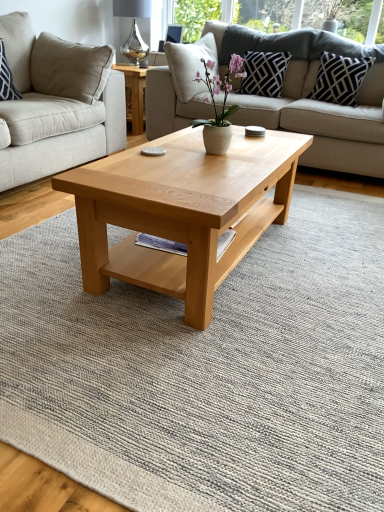
What do you see at coordinates (133, 28) in the screenshot? I see `silver metallic lamp at upper center` at bounding box center [133, 28].

Locate an element on the screen. This screenshot has width=384, height=512. silver metallic lamp at upper center is located at coordinates (133, 28).

What do you see at coordinates (324, 119) in the screenshot? I see `light beige fabric couch at center, placed as the second studio couch when sorted from left to right` at bounding box center [324, 119].

Measure the distance between point (161, 210) and camera.

Point (161, 210) and camera are 4.17 feet apart.

The width and height of the screenshot is (384, 512). I want to click on dark blue textured pillow at upper right, acting as the second pillow starting from the right, so click(x=264, y=73).

Find the location of a particular element. beige fabric studio couch at center, acting as the first studio couch starting from the left is located at coordinates (57, 104).

From the image's perspective, is dark blue textured pillow at upper right, the second pillow in the left-to-right sequence, above natural wood coffee table at center?

Yes.

From a real-world perspective, starting from the natural wood coffee table at center, which pillow is the 1st one vertically above it? Please provide its 2D coordinates.

[(264, 73)]

Which is nearer, (264, 65) or (180, 214)?

Point (264, 65) is farther from the camera than point (180, 214).

Consider the image. Is dark blue textured pillow at upper right, acting as the second pillow starting from the right, facing away from natural wood coffee table at center?

No.

Considering the relative positions of beige fabric studio couch at center, acting as the first studio couch starting from the left, and blue and white striped pillow at upper left, acting as the first pillow starting from the left, in the image provided, is beige fabric studio couch at center, acting as the first studio couch starting from the left, in front of blue and white striped pillow at upper left, acting as the first pillow starting from the left,?

Yes.

Which of these two, beige fabric studio couch at center, the 2th studio couch viewed from the right, or blue and white striped pillow at upper left, which is the 3th pillow in right-to-left order, is smaller?

blue and white striped pillow at upper left, which is the 3th pillow in right-to-left order.

From a real-world perspective, is beige fabric studio couch at center, the 2th studio couch viewed from the right, located beneath blue and white striped pillow at upper left, acting as the first pillow starting from the left?

Indeed, from a real-world perspective, beige fabric studio couch at center, the 2th studio couch viewed from the right, is positioned beneath blue and white striped pillow at upper left, acting as the first pillow starting from the left.

Which is farther from the camera, (100, 154) or (29, 72)?

The point (100, 154) is farther.

In the scene shown: From a real-world perspective, which is physically above, beige fabric studio couch at center, the 2th studio couch viewed from the right, or dark blue geometric-patterned pillow at upper right, placed as the first pillow when sorted from right to left?

In real-world perspective, dark blue geometric-patterned pillow at upper right, placed as the first pillow when sorted from right to left, is above.

Considering the relative sizes of beige fabric studio couch at center, acting as the first studio couch starting from the left, and dark blue geometric-patterned pillow at upper right, placed as the 3th pillow when sorted from left to right, in the image provided, is beige fabric studio couch at center, acting as the first studio couch starting from the left, smaller than dark blue geometric-patterned pillow at upper right, placed as the 3th pillow when sorted from left to right,?

No.

Is beige fabric studio couch at center, the 2th studio couch viewed from the right, taller or shorter than dark blue geometric-patterned pillow at upper right, placed as the first pillow when sorted from right to left?

In the image, beige fabric studio couch at center, the 2th studio couch viewed from the right, appears to be taller than dark blue geometric-patterned pillow at upper right, placed as the first pillow when sorted from right to left.

Is beige fabric studio couch at center, acting as the first studio couch starting from the left, wider or thinner than dark blue geometric-patterned pillow at upper right, placed as the first pillow when sorted from right to left?

In the image, beige fabric studio couch at center, acting as the first studio couch starting from the left, appears to be wider than dark blue geometric-patterned pillow at upper right, placed as the first pillow when sorted from right to left.

Is beige fabric studio couch at center, acting as the first studio couch starting from the left, next to dark blue textured pillow at upper right, the second pillow in the left-to-right sequence, and touching it?

They are not placed beside each other.

Can you tell me how much beige fabric studio couch at center, the 2th studio couch viewed from the right, and dark blue textured pillow at upper right, the second pillow in the left-to-right sequence, differ in facing direction?

The angle between the facing direction of beige fabric studio couch at center, the 2th studio couch viewed from the right, and the facing direction of dark blue textured pillow at upper right, the second pillow in the left-to-right sequence, is 89.6 degrees.

Is point (79, 156) positioned before point (254, 82)?

Yes, it is.

Choose the correct answer: Is natural wood coffee table at center inside beige fabric studio couch at center, the 2th studio couch viewed from the right, or outside it?

natural wood coffee table at center is outside beige fabric studio couch at center, the 2th studio couch viewed from the right.

Is there a large distance between natural wood coffee table at center and beige fabric studio couch at center, the 2th studio couch viewed from the right?

Yes, natural wood coffee table at center is far from beige fabric studio couch at center, the 2th studio couch viewed from the right.

From the image's perspective, does natural wood coffee table at center appear lower than beige fabric studio couch at center, acting as the first studio couch starting from the left?

Yes, from the image's perspective, natural wood coffee table at center is below beige fabric studio couch at center, acting as the first studio couch starting from the left.

Does natural wood coffee table at center have a smaller size compared to beige fabric studio couch at center, the 2th studio couch viewed from the right?

Yes, natural wood coffee table at center is smaller than beige fabric studio couch at center, the 2th studio couch viewed from the right.

In the scene shown: Considering the sizes of objects blue and white striped pillow at upper left, which is the 3th pillow in right-to-left order, and beige fabric studio couch at center, acting as the first studio couch starting from the left, in the image provided, who is taller, blue and white striped pillow at upper left, which is the 3th pillow in right-to-left order, or beige fabric studio couch at center, acting as the first studio couch starting from the left,?

With more height is beige fabric studio couch at center, acting as the first studio couch starting from the left.

Is blue and white striped pillow at upper left, which is the 3th pillow in right-to-left order, not near beige fabric studio couch at center, the 2th studio couch viewed from the right?

They are positioned close to each other.

Can beige fabric studio couch at center, acting as the first studio couch starting from the left, be found inside blue and white striped pillow at upper left, which is the 3th pillow in right-to-left order?

Definitely not — beige fabric studio couch at center, acting as the first studio couch starting from the left, is not inside blue and white striped pillow at upper left, which is the 3th pillow in right-to-left order.

How far apart are blue and white striped pillow at upper left, which is the 3th pillow in right-to-left order, and beige fabric studio couch at center, the 2th studio couch viewed from the right?

The distance of blue and white striped pillow at upper left, which is the 3th pillow in right-to-left order, from beige fabric studio couch at center, the 2th studio couch viewed from the right, is 29.91 centimeters.

Consider the image. From a real-world perspective, is white matte vase at center on light beige fabric couch at center, which is the 1th studio couch from right to left?

Yes, from a real-world perspective, white matte vase at center is over light beige fabric couch at center, which is the 1th studio couch from right to left

Which of these two, white matte vase at center or light beige fabric couch at center, placed as the second studio couch when sorted from left to right, stands shorter?

white matte vase at center.

Considering their positions, is white matte vase at center located in front of or behind light beige fabric couch at center, placed as the second studio couch when sorted from left to right?

In the image, white matte vase at center appears in front of light beige fabric couch at center, placed as the second studio couch when sorted from left to right.

Is white matte vase at center to the left of light beige fabric couch at center, placed as the second studio couch when sorted from left to right, from the viewer's perspective?

Correct, you'll find white matte vase at center to the left of light beige fabric couch at center, placed as the second studio couch when sorted from left to right.

In order to click on the 3rd pillow behind the natural wood coffee table at center, starting your count from the anchor in this screenshot , I will do `click(264, 73)`.

Starting from the blue and white striped pillow at upper left, which is the 3th pillow in right-to-left order, which studio couch is the 1st one to the right? Please provide its 2D coordinates.

[(57, 104)]

Considering their positions, is blue and white striped pillow at upper left, which is the 3th pillow in right-to-left order, positioned further to light beige fabric couch at center, which is the 1th studio couch from right to left, than silver metallic lamp at upper center?

Among the two, silver metallic lamp at upper center is located further to light beige fabric couch at center, which is the 1th studio couch from right to left.

From the image, which object appears to be farther from white matte vase at center, silver metallic lamp at upper center or light beige fabric couch at center, placed as the second studio couch when sorted from left to right?

silver metallic lamp at upper center.

From the image, which object appears to be nearer to white matte vase at center, blue and white striped pillow at upper left, acting as the first pillow starting from the left, or silver metallic lamp at upper center?

The object closer to white matte vase at center is blue and white striped pillow at upper left, acting as the first pillow starting from the left.

Which object lies further to the anchor point blue and white striped pillow at upper left, which is the 3th pillow in right-to-left order, dark blue textured pillow at upper right, the second pillow in the left-to-right sequence, or natural wood coffee table at center?

Based on the image, natural wood coffee table at center appears to be further to blue and white striped pillow at upper left, which is the 3th pillow in right-to-left order.

From the picture: Which object lies nearer to the anchor point beige fabric studio couch at center, the 2th studio couch viewed from the right, silver metallic lamp at upper center or light beige fabric couch at center, placed as the second studio couch when sorted from left to right?

Based on the image, light beige fabric couch at center, placed as the second studio couch when sorted from left to right, appears to be nearer to beige fabric studio couch at center, the 2th studio couch viewed from the right.

Estimate the real-world distances between objects in this image. Which object is further from light beige fabric couch at center, which is the 1th studio couch from right to left, natural wood coffee table at center or beige fabric studio couch at center, the 2th studio couch viewed from the right?

natural wood coffee table at center is further to light beige fabric couch at center, which is the 1th studio couch from right to left.

When comparing their distances from silver metallic lamp at upper center, does natural wood coffee table at center or dark blue textured pillow at upper right, the second pillow in the left-to-right sequence, seem closer?

dark blue textured pillow at upper right, the second pillow in the left-to-right sequence, is closer to silver metallic lamp at upper center.

From the image, which object appears to be nearer to dark blue geometric-patterned pillow at upper right, placed as the 3th pillow when sorted from left to right, light beige fabric couch at center, which is the 1th studio couch from right to left, or silver metallic lamp at upper center?

Based on the image, light beige fabric couch at center, which is the 1th studio couch from right to left, appears to be nearer to dark blue geometric-patterned pillow at upper right, placed as the 3th pillow when sorted from left to right.

I want to click on pillow between blue and white striped pillow at upper left, acting as the first pillow starting from the left, and dark blue geometric-patterned pillow at upper right, placed as the 3th pillow when sorted from left to right, so click(264, 73).

Identify the location of coffee table situated between beige fabric studio couch at center, acting as the first studio couch starting from the left, and light beige fabric couch at center, which is the 1th studio couch from right to left, from left to right. (181, 211).

In order to click on houseplant between blue and white striped pillow at upper left, acting as the first pillow starting from the left, and light beige fabric couch at center, which is the 1th studio couch from right to left, in the horizontal direction in this screenshot , I will do `click(222, 106)`.

Where is `houseplant located between blue and white striped pillow at upper left, acting as the first pillow starting from the left, and dark blue geometric-patterned pillow at upper right, placed as the 3th pillow when sorted from left to right, in the left-right direction`? Image resolution: width=384 pixels, height=512 pixels. houseplant located between blue and white striped pillow at upper left, acting as the first pillow starting from the left, and dark blue geometric-patterned pillow at upper right, placed as the 3th pillow when sorted from left to right, in the left-right direction is located at coordinates (222, 106).